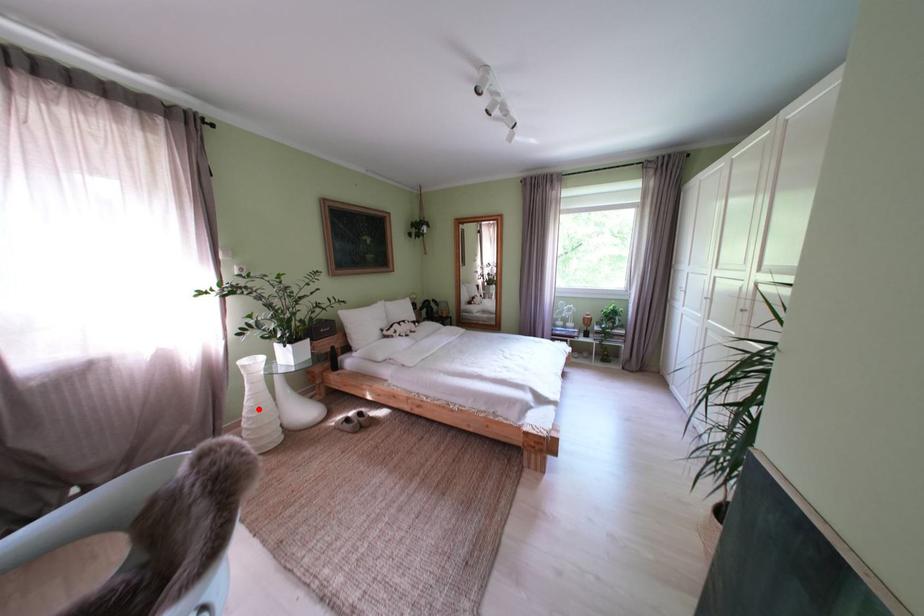
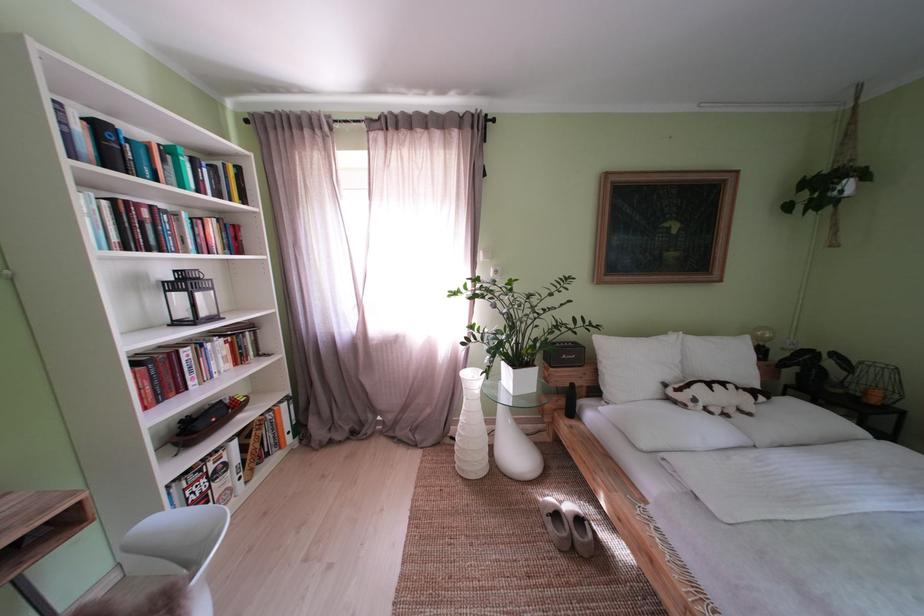
Locate, in the second image, the point that corresponds to the highlighted location in the first image.

(472, 424)